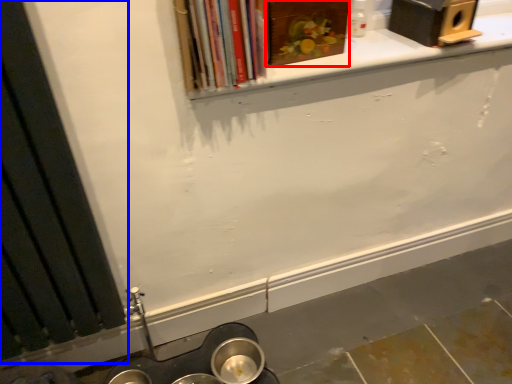
Question: Which point is closer to the camera, book (highlighted by a red box) or window frame (highlighted by a blue box)?

Choices:
 (A) book
 (B) window frame

Answer: (B)